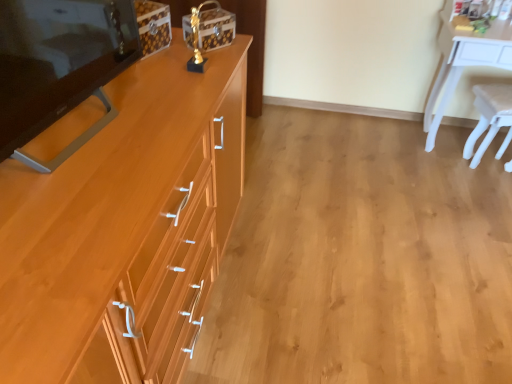
Image resolution: width=512 pixels, height=384 pixels. What are the coordinates of `white plastic chair at right` in the screenshot? It's located at (490, 119).

Image resolution: width=512 pixels, height=384 pixels. What do you see at coordinates (362, 258) in the screenshot?
I see `wooden drawer at center-left` at bounding box center [362, 258].

What is the approximate width of white glossy desk at upper right?

18.50 inches.

Where is `white plastic chair at right`? This screenshot has width=512, height=384. white plastic chair at right is located at coordinates (490, 119).

From a real-world perspective, which object stands above the other?

white glossy desk at upper right.

In the scene shown: Is white glossy desk at upper right with white plastic chair at right?

There is a gap between white glossy desk at upper right and white plastic chair at right.

Between white glossy desk at upper right and white plastic chair at right, which one appears on the right side from the viewer's perspective?

white plastic chair at right.

Which object is more forward, white glossy desk at upper right or white plastic chair at right?

white glossy desk at upper right is more forward.

Considering the sizes of objects matte wood changing table at left and white plastic chair at right in the image provided, who is wider, matte wood changing table at left or white plastic chair at right?

white plastic chair at right.

Does matte wood changing table at left have a lesser height compared to white plastic chair at right?

Correct, matte wood changing table at left is not as tall as white plastic chair at right.

Between matte wood changing table at left and white plastic chair at right, which one appears on the left side from the viewer's perspective?

matte wood changing table at left.

Could you tell me if matte wood changing table at left is turned towards white plastic chair at right?

No, matte wood changing table at left is not facing towards white plastic chair at right.

Considering the relative sizes of white glossy desk at upper right and matte wood changing table at left in the image provided, is white glossy desk at upper right smaller than matte wood changing table at left?

Incorrect, white glossy desk at upper right is not smaller in size than matte wood changing table at left.

Is white glossy desk at upper right in front of or behind matte wood changing table at left in the image?

white glossy desk at upper right is behind matte wood changing table at left.

Is white glossy desk at upper right oriented towards matte wood changing table at left?

No, white glossy desk at upper right is not turned towards matte wood changing table at left.

Is white glossy desk at upper right wider or thinner than matte wood changing table at left?

Considering their sizes, white glossy desk at upper right looks broader than matte wood changing table at left.

Image resolution: width=512 pixels, height=384 pixels. Identify the location of desk below the matte wood changing table at left (from a real-world perspective). (463, 62).

Is there a large distance between matte wood changing table at left and white glossy desk at upper right?

Absolutely, matte wood changing table at left is distant from white glossy desk at upper right.

Based on their sizes in the image, would you say matte wood changing table at left is bigger or smaller than white glossy desk at upper right?

Considering their sizes, matte wood changing table at left takes up less space than white glossy desk at upper right.

Between wooden drawer at center-left and matte wood changing table at left, which one is positioned behind?

Positioned behind is wooden drawer at center-left.

Is wooden drawer at center-left inside the boundaries of matte wood changing table at left, or outside?

wooden drawer at center-left exists outside the volume of matte wood changing table at left.

Is wooden drawer at center-left taller or shorter than matte wood changing table at left?

wooden drawer at center-left is shorter than matte wood changing table at left.

From the image's perspective, which is above, wooden drawer at center-left or matte wood changing table at left?

matte wood changing table at left is shown above in the image.

Are white glossy desk at upper right and light brown wood cabinet at left located far from each other?

Yes, white glossy desk at upper right is far from light brown wood cabinet at left.

Do you think white glossy desk at upper right is within light brown wood cabinet at left, or outside of it?

white glossy desk at upper right is outside light brown wood cabinet at left.

Is white glossy desk at upper right at the left side of light brown wood cabinet at left?

Incorrect, white glossy desk at upper right is not on the left side of light brown wood cabinet at left.

In the image, is white glossy desk at upper right positioned in front of or behind light brown wood cabinet at left?

In the image, white glossy desk at upper right appears behind light brown wood cabinet at left.

Consider the image. Does white plastic chair at right turn towards matte wood changing table at left?

No, white plastic chair at right is not facing towards matte wood changing table at left.

Considering the relative sizes of white plastic chair at right and matte wood changing table at left in the image provided, is white plastic chair at right thinner than matte wood changing table at left?

In fact, white plastic chair at right might be wider than matte wood changing table at left.

From the image's perspective, would you say white plastic chair at right is shown under matte wood changing table at left?

Actually, white plastic chair at right appears above matte wood changing table at left in the image.

This screenshot has height=384, width=512. I want to click on chair behind the white glossy desk at upper right, so click(490, 119).

You are a GUI agent. You are given a task and a screenshot of the screen. Output one action in this format:
    pyautogui.click(x=<x>, y=<y>)
    Task: Click on the chair below the matte wood changing table at left (from a real-world perspective)
    The width and height of the screenshot is (512, 384).
    Given the screenshot: What is the action you would take?
    pyautogui.click(x=490, y=119)

Considering their positions, is white glossy desk at upper right positioned further to white plastic chair at right than matte wood changing table at left?

matte wood changing table at left is further to white plastic chair at right.

Looking at the image, which one is located closer to white plastic chair at right, light brown wood cabinet at left or matte wood changing table at left?

light brown wood cabinet at left.

From the image, which object appears to be nearer to white glossy desk at upper right, white plastic chair at right or light brown wood cabinet at left?

white plastic chair at right is positioned closer to the anchor white glossy desk at upper right.

Which object lies nearer to the anchor point white glossy desk at upper right, matte wood changing table at left or white plastic chair at right?

Among the two, white plastic chair at right is located nearer to white glossy desk at upper right.

Based on their spatial positions, is white plastic chair at right or matte wood changing table at left closer to light brown wood cabinet at left?

matte wood changing table at left.

From the image, which object appears to be farther from white plastic chair at right, white glossy desk at upper right or light brown wood cabinet at left?

light brown wood cabinet at left is further to white plastic chair at right.

Looking at the image, which one is located closer to white glossy desk at upper right, matte wood changing table at left or wooden drawer at center-left?

A: wooden drawer at center-left lies closer to white glossy desk at upper right than the other object.

Estimate the real-world distances between objects in this image. Which object is closer to wooden drawer at center-left, white glossy desk at upper right or matte wood changing table at left?

white glossy desk at upper right is closer to wooden drawer at center-left.

This screenshot has height=384, width=512. I want to click on plain between matte wood changing table at left and white glossy desk at upper right from left to right, so click(362, 258).

Image resolution: width=512 pixels, height=384 pixels. In order to click on desk situated between matte wood changing table at left and white plastic chair at right from left to right in this screenshot , I will do `click(463, 62)`.

Find the location of `cabinetry situated between matte wood changing table at left and wooden drawer at center-left from left to right`. cabinetry situated between matte wood changing table at left and wooden drawer at center-left from left to right is located at coordinates (124, 227).

Locate an element on the screen. plain between light brown wood cabinet at left and white glossy desk at upper right is located at coordinates (362, 258).